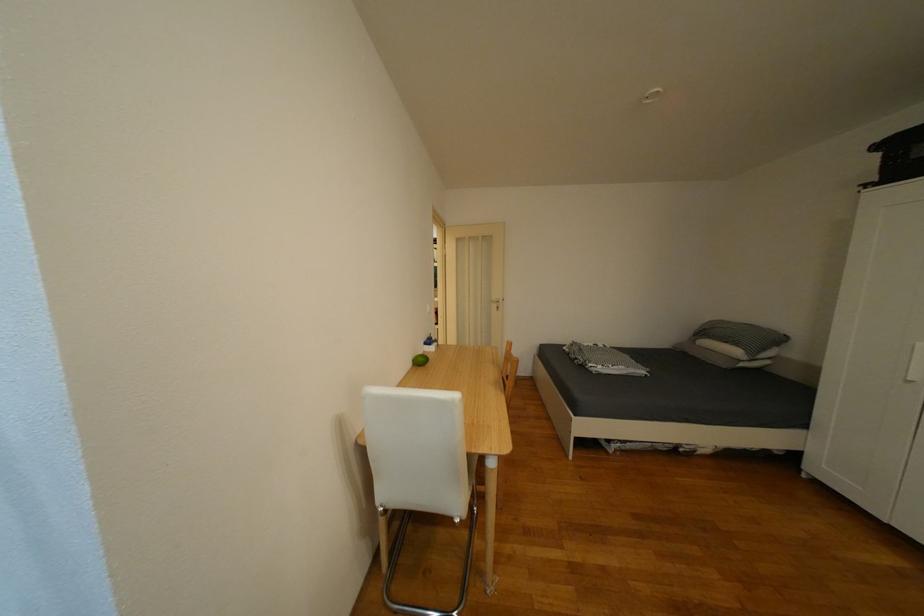
Find the location of a particular element. This screenshot has width=924, height=616. striped pillow is located at coordinates (603, 360).